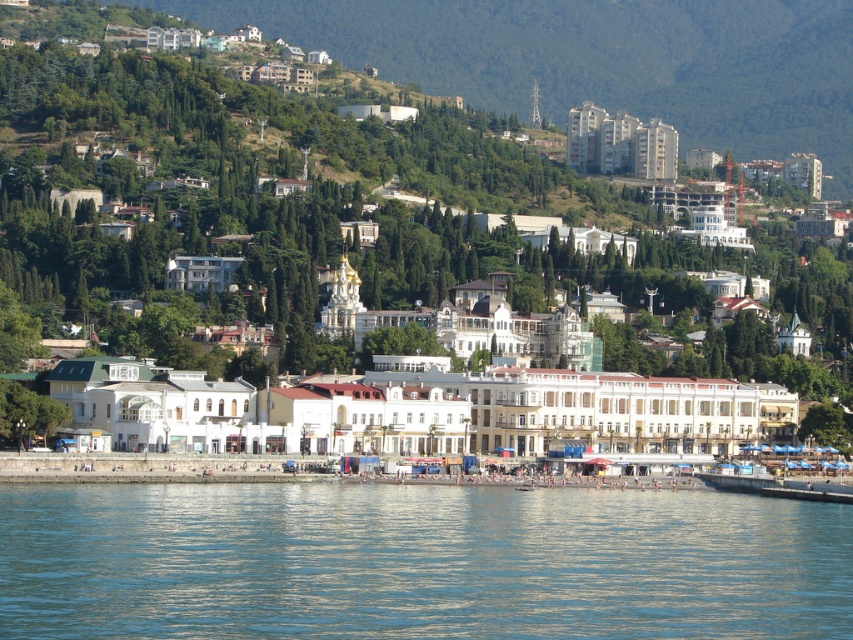
You are standing at the point with coordinates (386, 218) in the coastal town. What object is exactly at your current location?

The white glossy building at center is exactly at the point (386, 218).

You are a tourist standing at the edge of the clear blue water at lower center, looking toward the white glossy building at center. Which object is taller?

The white glossy building at center is much taller than the clear blue water at lower center.